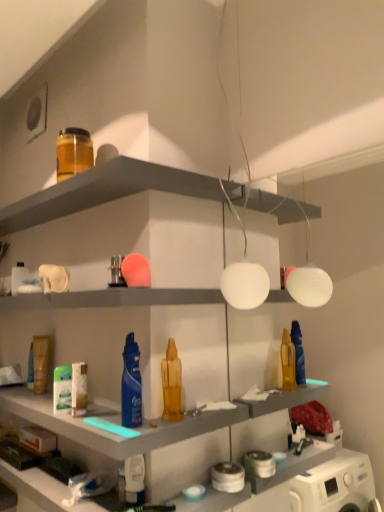
Question: Is point (130, 394) positioned closer to the camera than point (79, 138)?

Choices:
 (A) farther
 (B) closer

Answer: (B)

Question: Considering the relative positions of blue glossy hair spray at center and translucent amber jar at upper left, placed as the 5th toiletry when sorted from right to left, in the image provided, is blue glossy hair spray at center to the left or to the right of translucent amber jar at upper left, placed as the 5th toiletry when sorted from right to left,?

Choices:
 (A) right
 (B) left

Answer: (A)

Question: Which object is the farthest from the metallic silver toiletry at center, which ranks as the 3th toiletry in right-to-left order?

Choices:
 (A) translucent amber jar at upper left, which ranks as the 6th toiletry in bottom-to-top order
 (B) white matte tube at center, arranged as the 3th toiletry when ordered from the bottom
 (C) white glossy lotion at lower center, arranged as the 2th toiletry when viewed from the right
 (D) wooden container at left, which ranks as the second toiletry in bottom-to-top order
 (E) matte plastic shelf at upper center

Answer: (D)

Question: Considering the real-world distances, which object is closest to the metallic silver toiletry at center, which ranks as the 3th toiletry in right-to-left order?

Choices:
 (A) blue glossy hair spray at center
 (B) translucent amber bottle at center, placed as the 5th toiletry when sorted from back to front
 (C) white matte tube at center, which ranks as the 4th toiletry in right-to-left order
 (D) white glossy lotion at lower center, acting as the first toiletry starting from the front
 (E) white matte light fixture at center

Answer: (A)